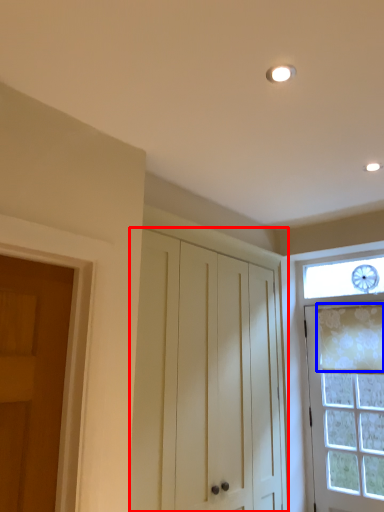
Question: Which point is closer to the camera, cabinetry (highlighted by a red box) or curtain (highlighted by a blue box)?

Choices:
 (A) cabinetry
 (B) curtain

Answer: (A)